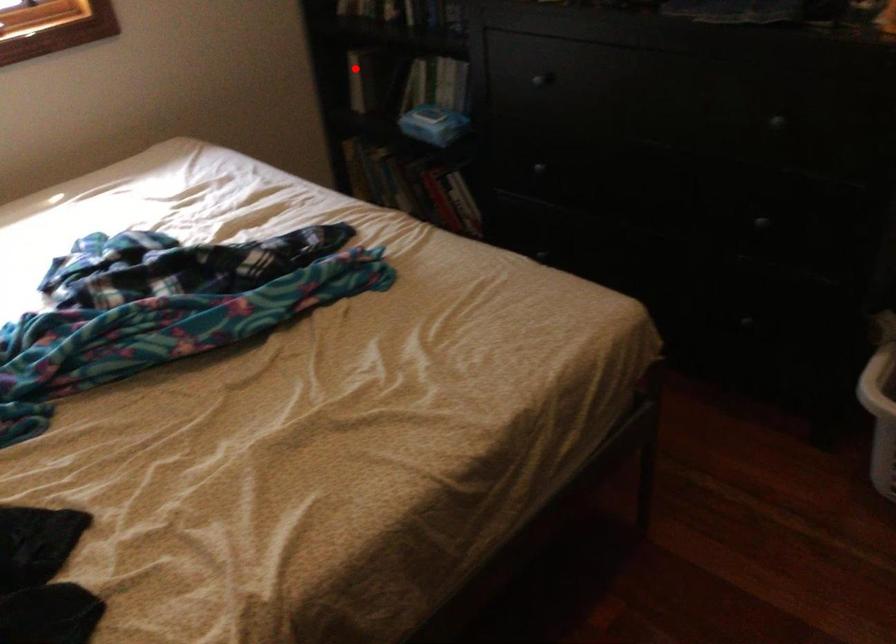
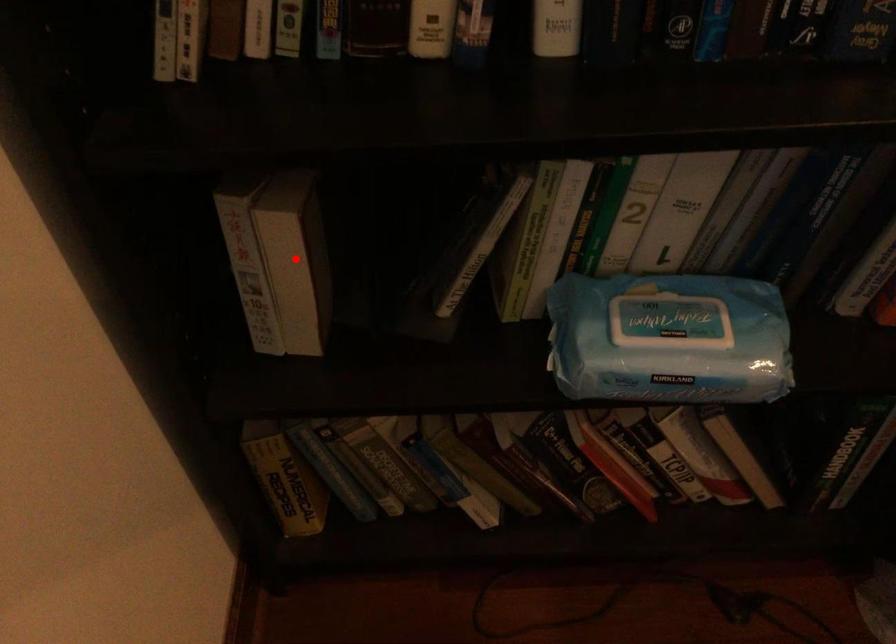
I am providing you with two images of the same scene from different viewpoints. A red point is marked on the first image and another point is marked on the second image. Do the highlighted points in image1 and image2 indicate the same real-world spot?

Yes